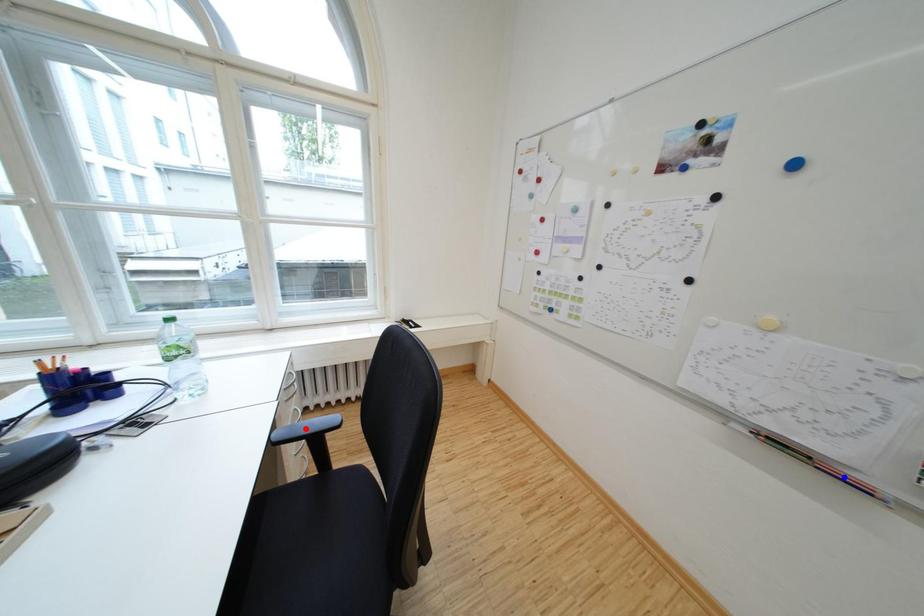
Question: Two points are marked on the image. Which point is closer to the camera?

Choices:
 (A) Blue point is closer.
 (B) Red point is closer.

Answer: (A)